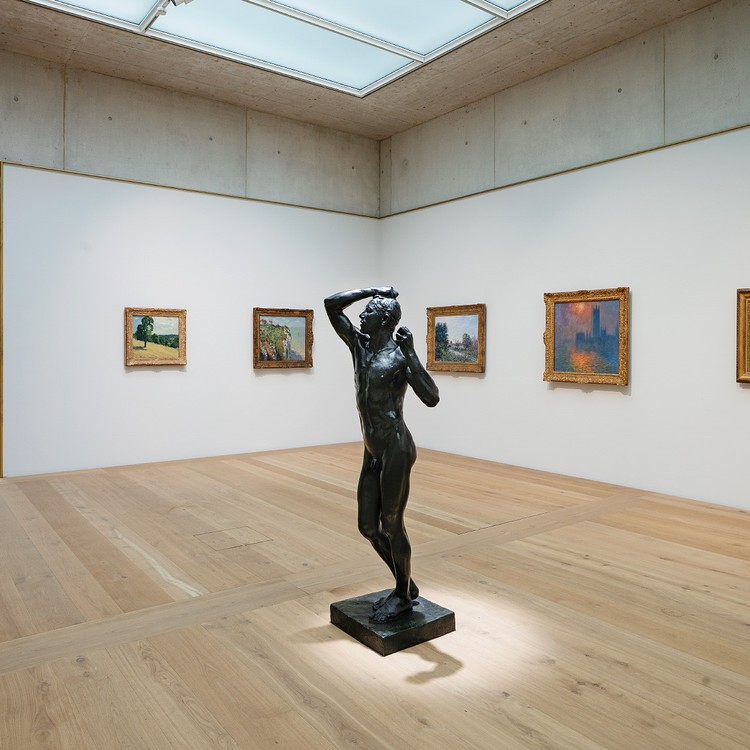
What are the coordinates of `white wall` in the screenshot? It's located at (178, 260), (639, 235).